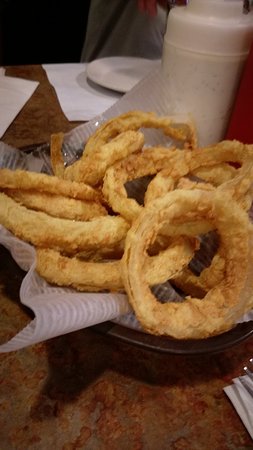
Where is `tabletop`? tabletop is located at coordinates (128, 405).